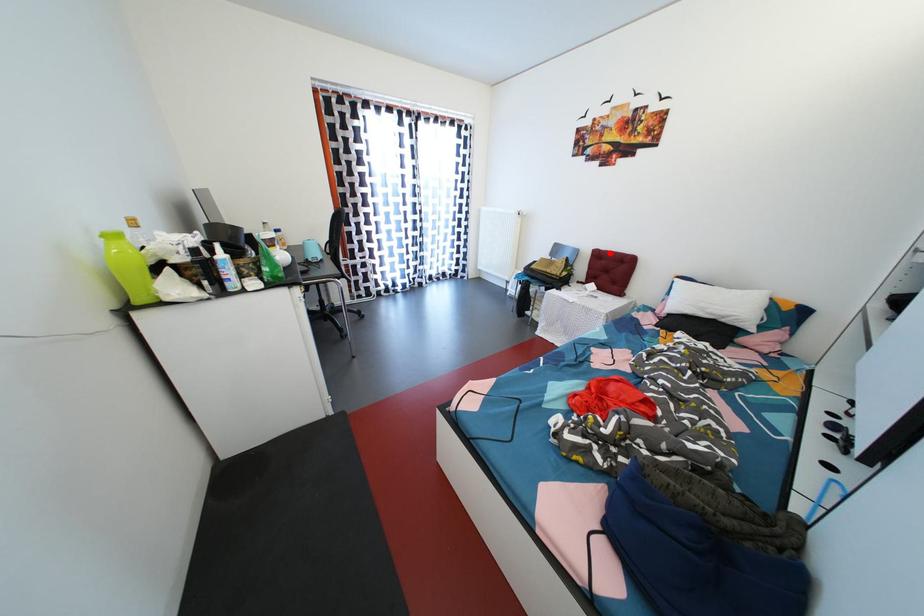
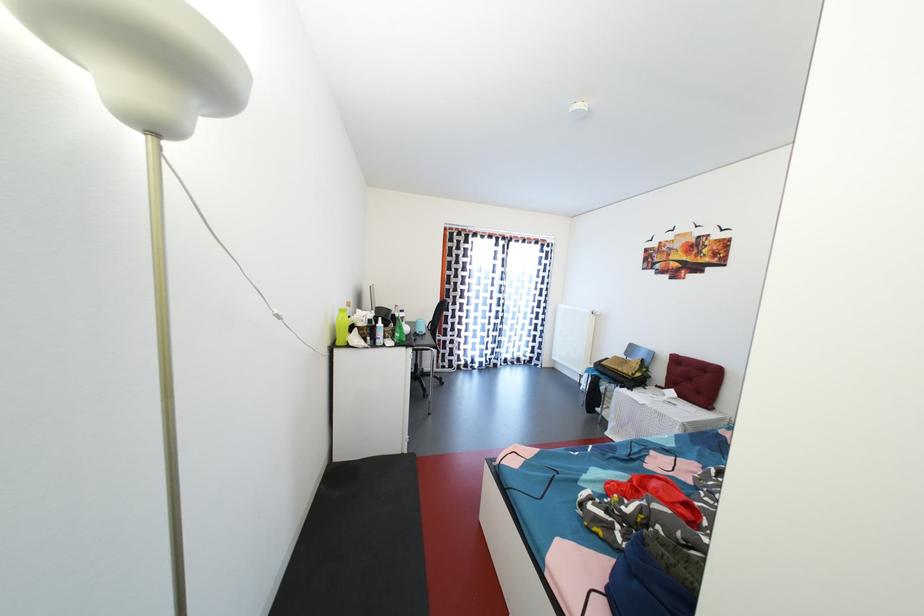
Question: I am providing you with two images of the same scene from different viewpoints. A red point is shown in image1. For the corresponding object point in image2, is it positioned nearer or farther from the camera?

Choices:
 (A) Nearer
 (B) Farther

Answer: (B)